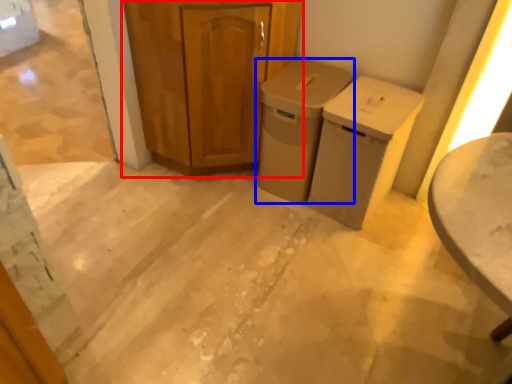
Question: Which object appears farthest to the camera in this image, cabinetry (highlighted by a red box) or waste container (highlighted by a blue box)?

Choices:
 (A) cabinetry
 (B) waste container

Answer: (B)